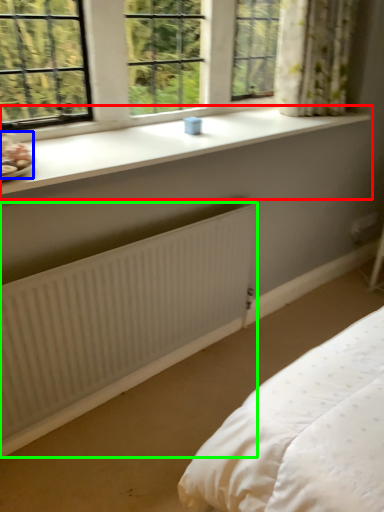
Question: Based on their relative distances, which object is nearer to window sill (highlighted by a red box)? Choose from food (highlighted by a blue box) and radiator (highlighted by a green box).

Choices:
 (A) food
 (B) radiator

Answer: (A)